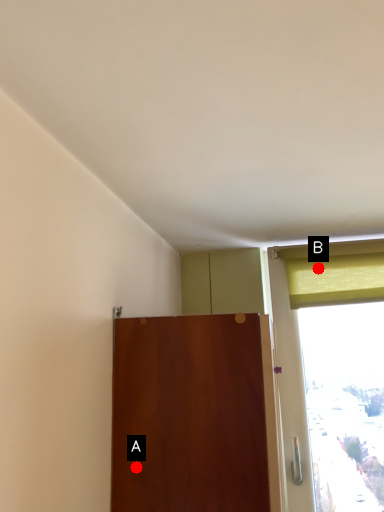
Question: Two points are circled on the image, labeled by A and B beside each circle. Which of the following is the closest to the observer?

Choices:
 (A) A is closer
 (B) B is closer

Answer: (A)